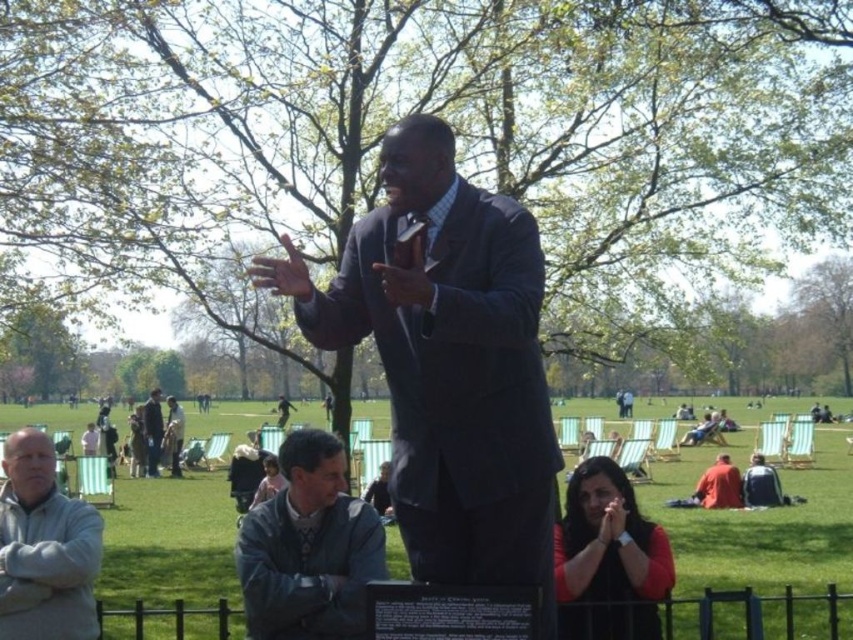
You are standing at the entrance of the park and see the gray leather jacket at lower center. If you walk straight ahead, will you pass by the jacket before reaching the fence?

The gray leather jacket at lower center is located at point (308, 547), which is behind the fence. Therefore, you would encounter the fence first before reaching the jacket.

You are organizing a photo shoot and need to place two jackets in the scene. The gray leather jacket at lower center and the dark brown leather jacket at center must be positioned according to their sizes. Which jacket should you place first if you want to ensure there is enough space for both?

The gray leather jacket at lower center is wider than the dark brown leather jacket at center. You should place the gray leather jacket at lower center first to ensure there is enough space for both jackets.